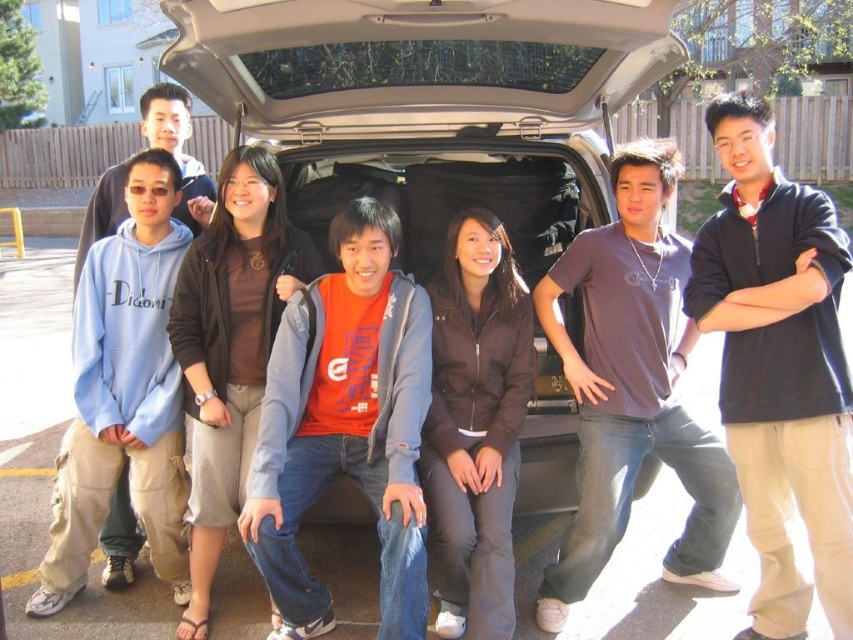
Question: Which point is closer to the camera?

Choices:
 (A) black fabric minivan at center
 (B) dark brown jacket at center
 (C) dark blue zip-up sweater at center
 (D) matte orange t-shirt at center

Answer: (C)

Question: Is black fabric minivan at center bigger than dark brown jacket at center?

Choices:
 (A) yes
 (B) no

Answer: (A)

Question: Which object appears closest to the camera in this image?

Choices:
 (A) matte orange t-shirt at center
 (B) dark brown jacket at center

Answer: (A)

Question: Does black fabric minivan at center have a lesser width compared to brown matte jacket at center?

Choices:
 (A) yes
 (B) no

Answer: (B)

Question: Based on their relative distances, which object is nearer to the black fabric minivan at center?

Choices:
 (A) dark blue zip-up sweater at center
 (B) dark brown jacket at center
 (C) matte orange t-shirt at center
 (D) brown matte jacket at center

Answer: (D)

Question: Is dark blue zip-up sweater at center below dark brown jacket at center?

Choices:
 (A) yes
 (B) no

Answer: (B)